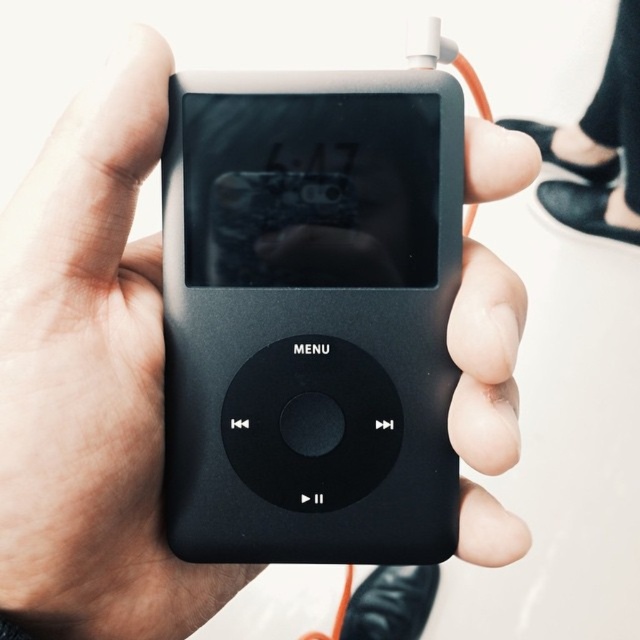
You are examining the iPod screen and notice two points marked on it. Which point, point (195, 92) or point (621, 61), is closer to your eyes?

Point (195, 92) is closer to the viewer than point (621, 61).